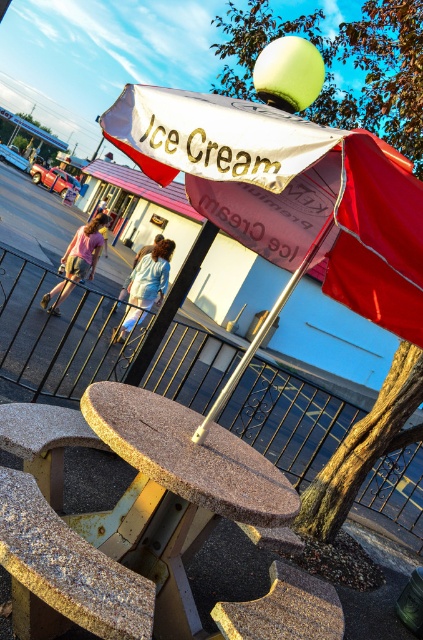
Can you confirm if white fabric umbrella at center is positioned above rustic wood stool at lower left?

Indeed, white fabric umbrella at center is positioned over rustic wood stool at lower left.

Is white fabric umbrella at center smaller than rustic wood stool at lower left?

Incorrect, white fabric umbrella at center is not smaller in size than rustic wood stool at lower left.

Is point (323, 205) behind point (148, 624)?

That is True.

At what (x,y) coordinates should I click in order to perform the action: click on white fabric umbrella at center. Please return your answer as a coordinate pair (x, y). Looking at the image, I should click on (288, 193).

Which is above, rustic wood stool at lower left or granite-like stool at center?

granite-like stool at center

Does point (43, 545) come closer to viewer compared to point (8, 428)?

Yes, point (43, 545) is closer to viewer.

Locate an element on the screen. This screenshot has width=423, height=640. rustic wood stool at lower left is located at coordinates (68, 564).

Between white fabric umbrella at center and granite-like stool at center, which one has more height?

white fabric umbrella at center

Is white fabric umbrella at center further to the viewer compared to granite-like stool at center?

No, white fabric umbrella at center is in front of granite-like stool at center.

Does point (414, 310) come closer to viewer compared to point (49, 429)?

No, it is not.

What are the coordinates of `white fabric umbrella at center` in the screenshot? It's located at (288, 193).